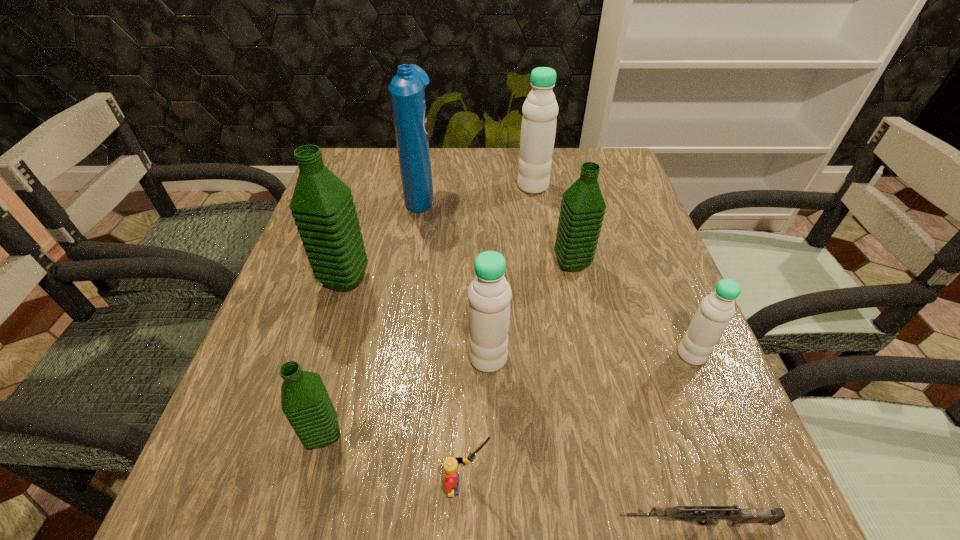
You are a GUI agent. You are given a task and a screenshot of the screen. Output one action in this format:
    pyautogui.click(x=<x>, y=<y>)
    Task: Click on the vacant space located 0.380m on the left of the smallest white water bottle
    This screenshot has width=960, height=540.
    Given the screenshot: What is the action you would take?
    pyautogui.click(x=466, y=355)

Find the location of a particular element. vacant space located 0.290m on the back of the nearest green water bottle is located at coordinates (362, 286).

Identify the location of free space located 0.380m on the front-facing side of the second shortest object. Image resolution: width=960 pixels, height=540 pixels. (755, 485).

Identify the location of free space located 0.310m aimed along the barrel of the grey gun. This screenshot has height=540, width=960. (394, 524).

In order to click on vacant region located 0.380m aimed along the barrel of the grey gun in this screenshot , I will do `click(342, 524)`.

Where is `free space located aimed along the barrel of the grey gun`? The width and height of the screenshot is (960, 540). free space located aimed along the barrel of the grey gun is located at coordinates (504, 524).

Identify the location of shampoo situated at the far edge. This screenshot has height=540, width=960. (407, 89).

At what (x,y) coordinates should I click in order to perform the action: click on water bottle present at the far edge. Please return your answer as a coordinate pair (x, y). The image size is (960, 540). Looking at the image, I should click on (540, 109).

Image resolution: width=960 pixels, height=540 pixels. I want to click on Lego at the near edge, so click(x=450, y=465).

The height and width of the screenshot is (540, 960). Find the location of `gun that is positioned at the near edge`. gun that is positioned at the near edge is located at coordinates (701, 515).